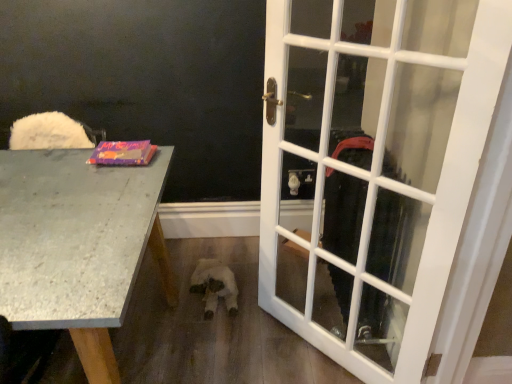
The image size is (512, 384). I want to click on free spot to the left of white plush toy at center, so click(x=175, y=289).